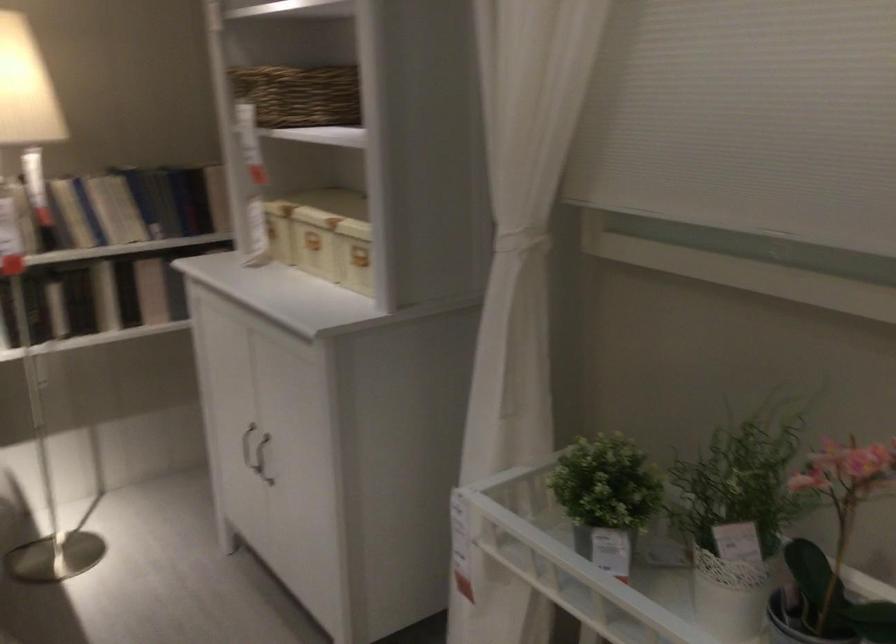
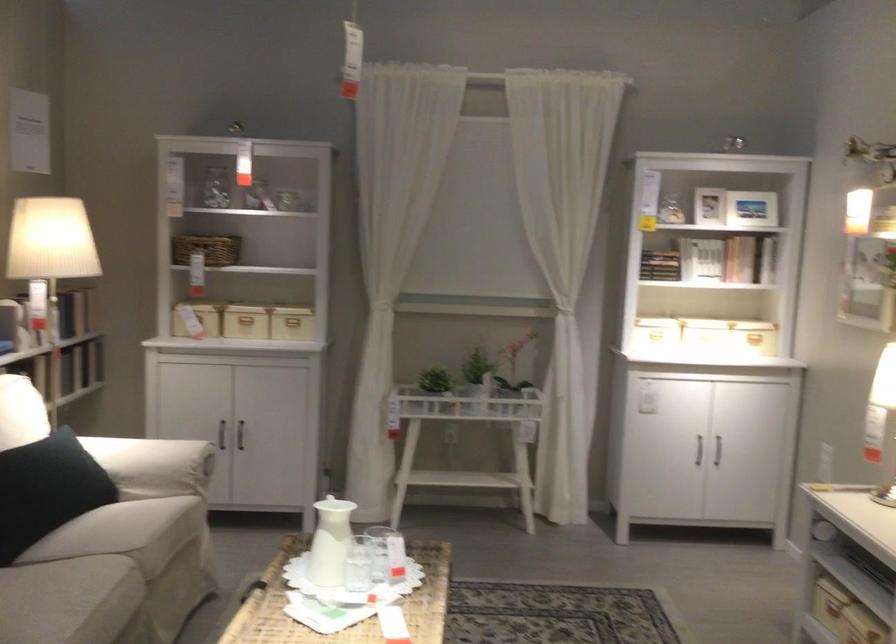
The point at (257, 109) is marked in the first image. Where is the corresponding point in the second image?

(207, 249)